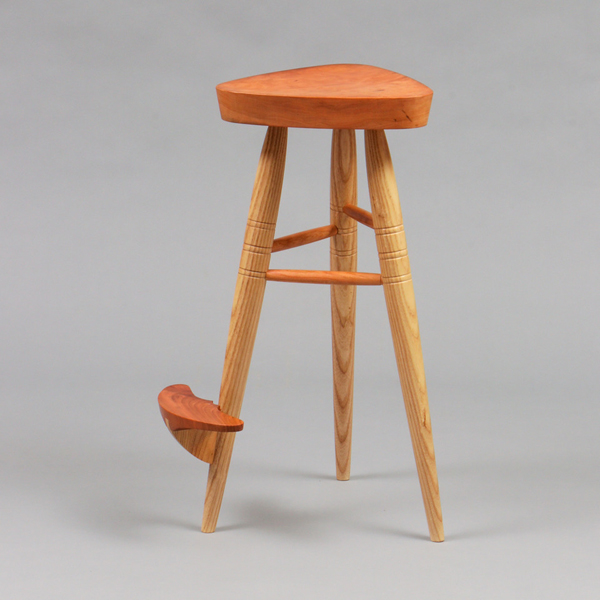
Where is `seat top`? Image resolution: width=600 pixels, height=600 pixels. seat top is located at coordinates (344, 79).